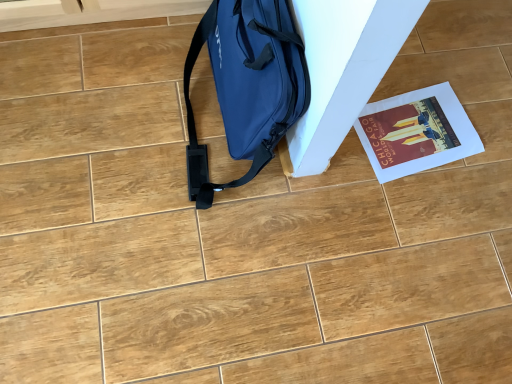
Locate an element on the screen. The height and width of the screenshot is (384, 512). free point above matte paper poster at lower right (from a real-world perspective) is located at coordinates (420, 137).